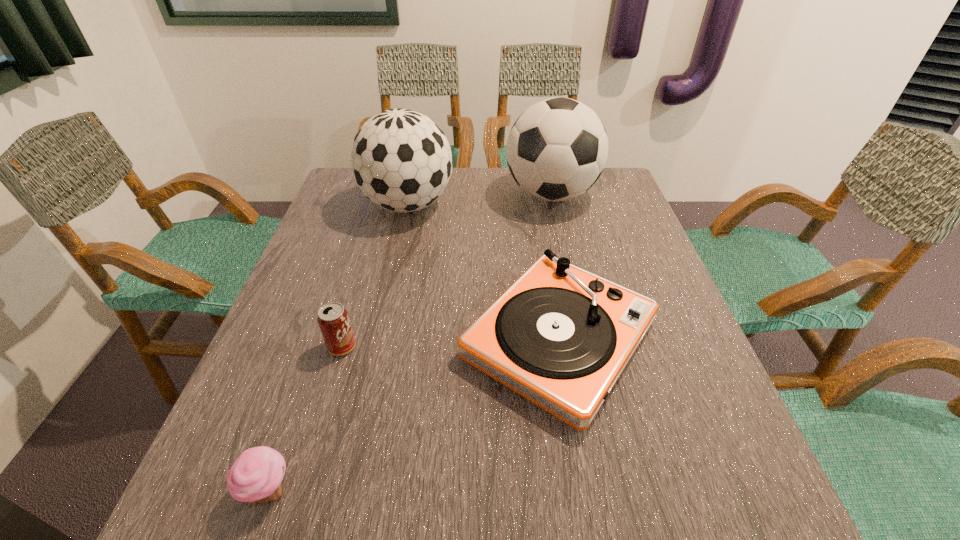
Image resolution: width=960 pixels, height=540 pixels. I want to click on free space between the left soccer ball and the record player, so click(x=484, y=272).

Find the location of a particular element. This screenshot has width=960, height=540. free space that is in between the left soccer ball and the record player is located at coordinates (484, 272).

Where is `object identified as the second closest to the right soccer ball`? object identified as the second closest to the right soccer ball is located at coordinates click(x=560, y=336).

Select which object appears as the closest to the soda can. Please provide its 2D coordinates. Your answer should be formatted as a tuple, i.e. [(x, y)], where the tuple contains the x and y coordinates of a point satisfying the conditions above.

[(560, 336)]

The width and height of the screenshot is (960, 540). Find the location of `blank area in the image that satisfies the following two spatial constraints: 1. on the back side of the left soccer ball; 2. on the left side of the cupcake`. blank area in the image that satisfies the following two spatial constraints: 1. on the back side of the left soccer ball; 2. on the left side of the cupcake is located at coordinates (368, 205).

You are a GUI agent. You are given a task and a screenshot of the screen. Output one action in this format:
    pyautogui.click(x=<x>, y=<y>)
    Task: Click on the vacant space that satisfies the following two spatial constraints: 1. on the front side of the record player; 2. on the left side of the left soccer ball
    
    Given the screenshot: What is the action you would take?
    pyautogui.click(x=378, y=339)